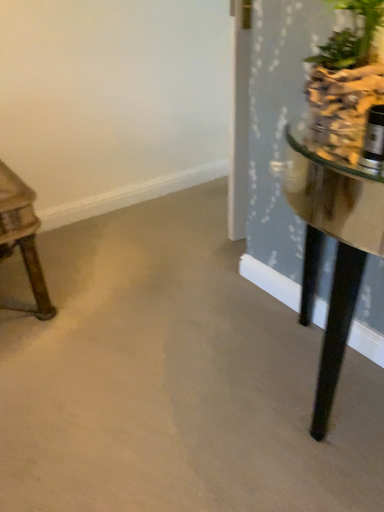
Question: From the image's perspective, is smooth concrete floor at center above wooden table at left?

Choices:
 (A) no
 (B) yes

Answer: (A)

Question: Could you tell me if smooth concrete floor at center is turned towards wooden table at left?

Choices:
 (A) no
 (B) yes

Answer: (A)

Question: Can you confirm if smooth concrete floor at center is thinner than wooden table at left?

Choices:
 (A) no
 (B) yes

Answer: (B)

Question: Is smooth concrete floor at center located outside wooden table at left?

Choices:
 (A) no
 (B) yes

Answer: (B)

Question: Is smooth concrete floor at center not near wooden table at left?

Choices:
 (A) no
 (B) yes

Answer: (A)

Question: Is smooth concrete floor at center smaller than wooden table at left?

Choices:
 (A) yes
 (B) no

Answer: (B)

Question: Does wooden table at left have a lesser width compared to green leafy plant at upper right?

Choices:
 (A) yes
 (B) no

Answer: (B)

Question: Is wooden table at left further to camera compared to green leafy plant at upper right?

Choices:
 (A) yes
 (B) no

Answer: (A)

Question: From a real-world perspective, is wooden table at left over green leafy plant at upper right?

Choices:
 (A) no
 (B) yes

Answer: (A)

Question: Is wooden table at left not near green leafy plant at upper right?

Choices:
 (A) yes
 (B) no

Answer: (B)

Question: Can you confirm if wooden table at left is wider than green leafy plant at upper right?

Choices:
 (A) yes
 (B) no

Answer: (A)

Question: From the image's perspective, would you say wooden table at left is positioned over green leafy plant at upper right?

Choices:
 (A) yes
 (B) no

Answer: (B)

Question: Does green leafy plant at upper right have a larger size compared to smooth concrete floor at center?

Choices:
 (A) yes
 (B) no

Answer: (B)